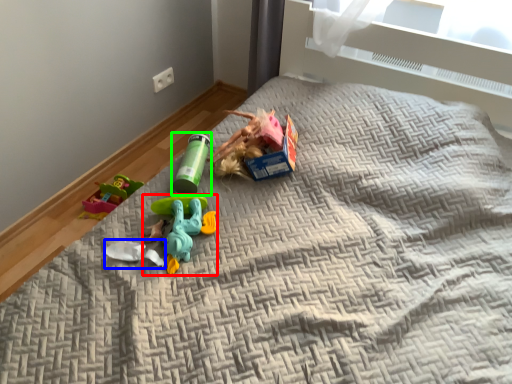
Question: Which object is the farthest from toy (highlighted by a red box)? Choose among these: toy (highlighted by a blue box) or toy (highlighted by a green box).

Choices:
 (A) toy
 (B) toy

Answer: (B)